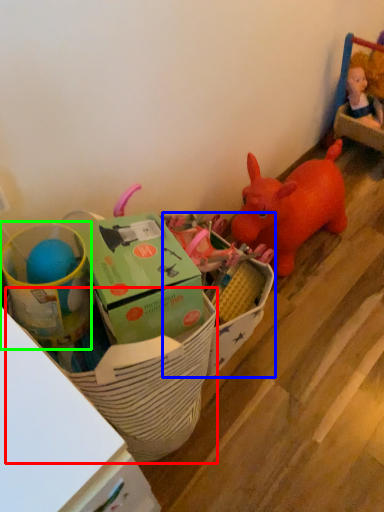
Question: Considering the real-world distances, which object is closest to basket (highlighted by a red box)? storage box (highlighted by a blue box) or toy (highlighted by a green box).

Choices:
 (A) storage box
 (B) toy

Answer: (B)